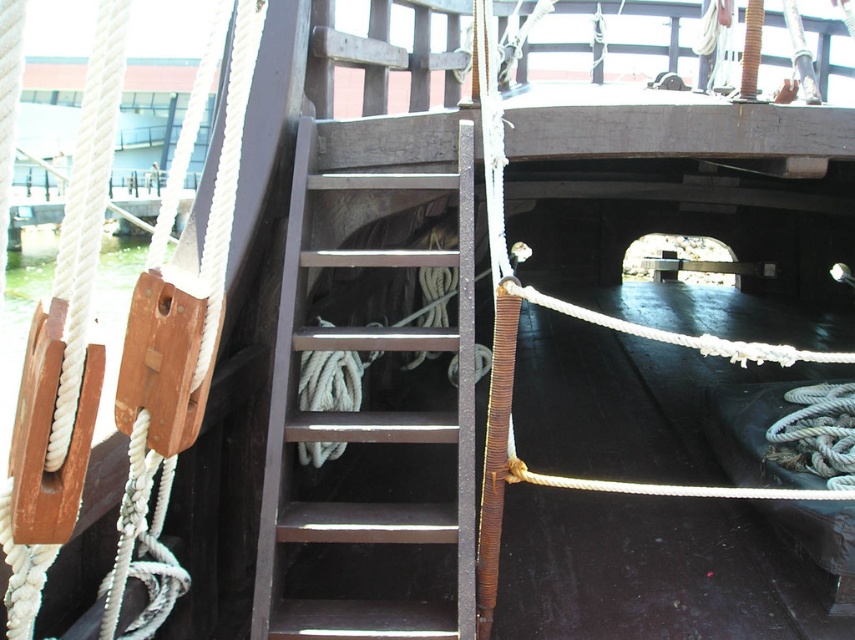
From the picture: You are a sailor on the ship and need to secure a new rope. You have two options available on deck, the rustic wood stairs at center and the white rope at lower right. Which object is larger and should be used as an anchor point?

The rustic wood stairs at center is bigger than the white rope at lower right, so it should be used as the anchor point because it provides a more stable and secure base for the new rope.

You are a sailor on the ship and need to secure both the white rope at lower right and the white rope at center. Which rope should you adjust first if you want to start with the one closer to the ladder?

The white rope at center is closer to the ladder than the white rope at lower right, so you should adjust the white rope at center first.

You are a sailor on the ship and need to choose a rope to secure a heavy load. You have two options available on the deck. Which rope should you choose between the white rope at lower right and the white rope at center?

You should choose the white rope at center because it has a larger size compared to the white rope at lower right, making it more suitable for securing heavy loads.